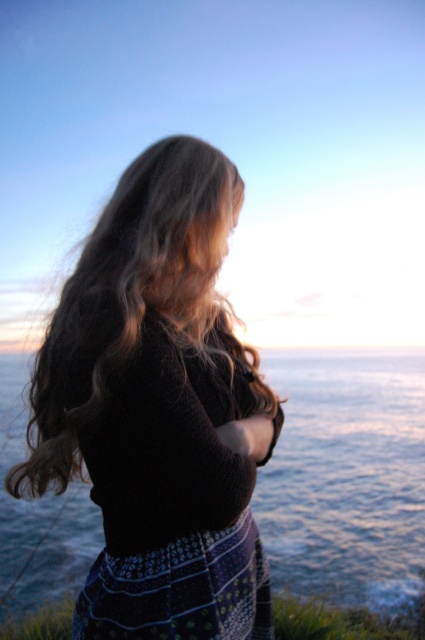
Between point (198, 275) and point (303, 362), which one is positioned in front?

Positioned in front is point (198, 275).

Is knitted black sweater at center above blue water at center?

Indeed, knitted black sweater at center is positioned over blue water at center.

Between point (257, 429) and point (370, 376), which one is positioned behind?

The point (370, 376) is behind.

What are the coordinates of `knitted black sweater at center` in the screenshot? It's located at (158, 408).